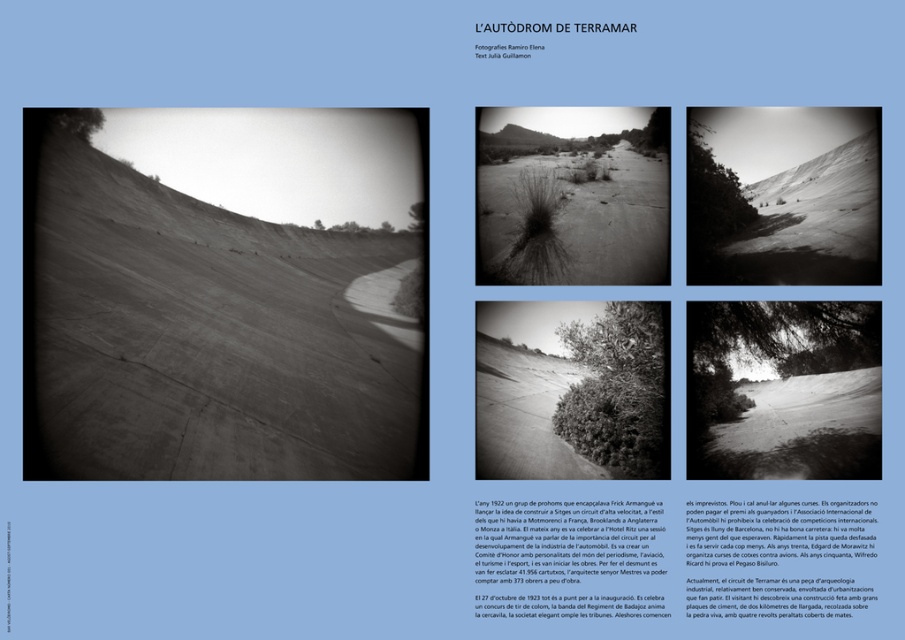
Question: Which object is the closest to the grainy sand hill at center?

Choices:
 (A) smooth sand hill at left
 (B) smooth sand dune at center

Answer: (B)

Question: Is smooth sand hill at left smaller than smooth sand dune at center?

Choices:
 (A) no
 (B) yes

Answer: (A)

Question: Is smooth sand hill at left closer to the viewer compared to smooth sand dune at center?

Choices:
 (A) no
 (B) yes

Answer: (B)

Question: Which point appears farthest from the camera in this image?

Choices:
 (A) (818, 268)
 (B) (303, 392)

Answer: (A)

Question: Which point is closer to the camera?

Choices:
 (A) (696, 145)
 (B) (606, 192)

Answer: (A)

Question: Can you confirm if smooth sand dune at center is smaller than grainy sand hill at center?

Choices:
 (A) yes
 (B) no

Answer: (A)